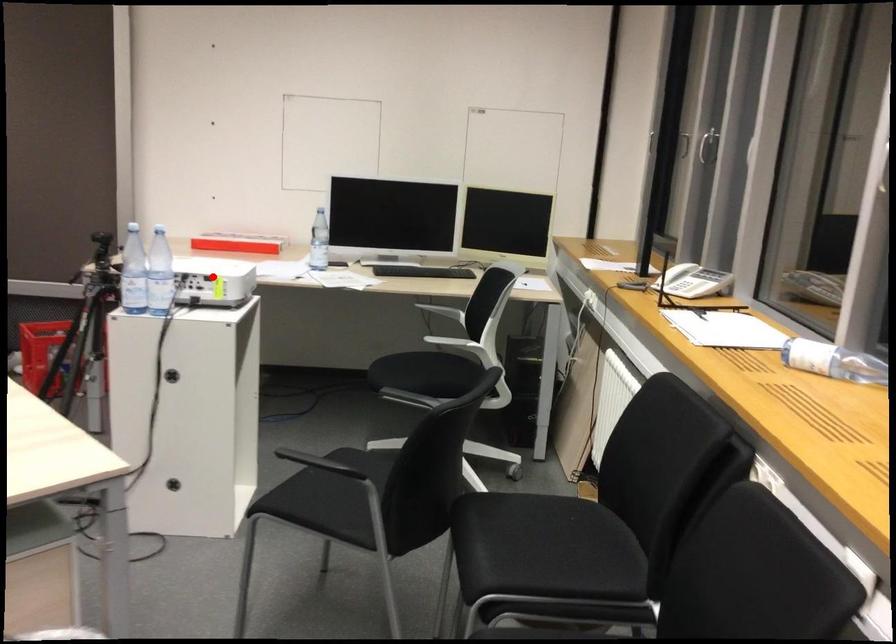
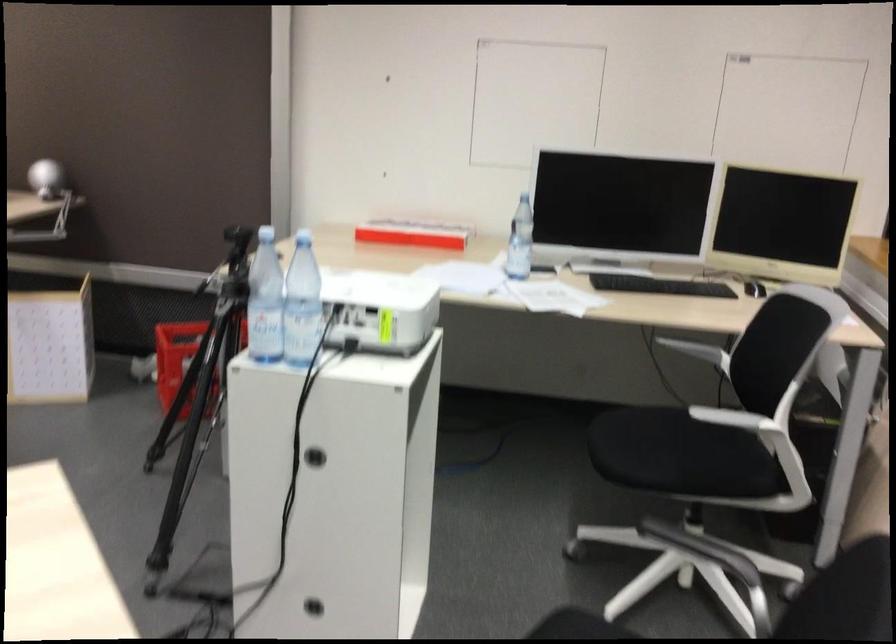
Find the pixel in the second image that matches the highlighted location in the first image.

(380, 308)